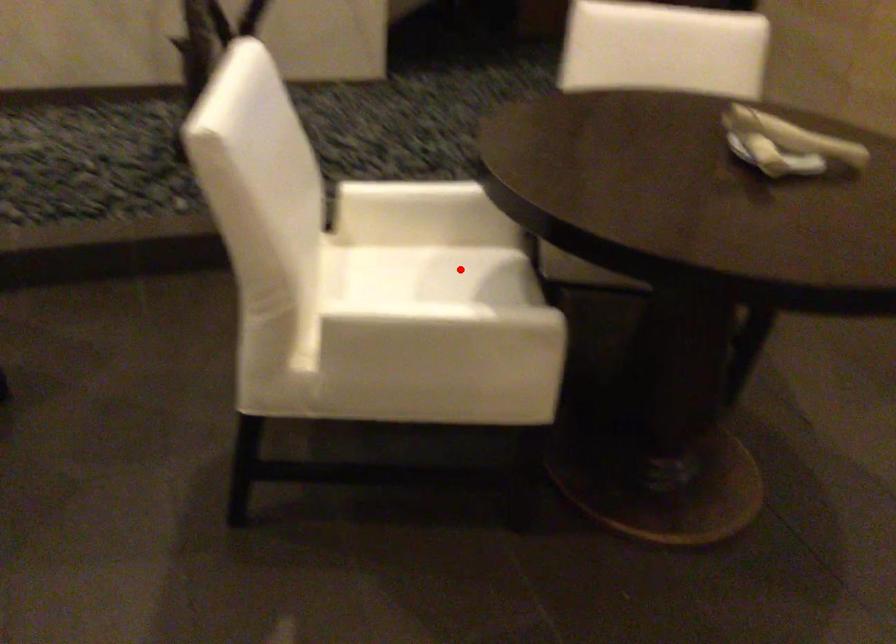
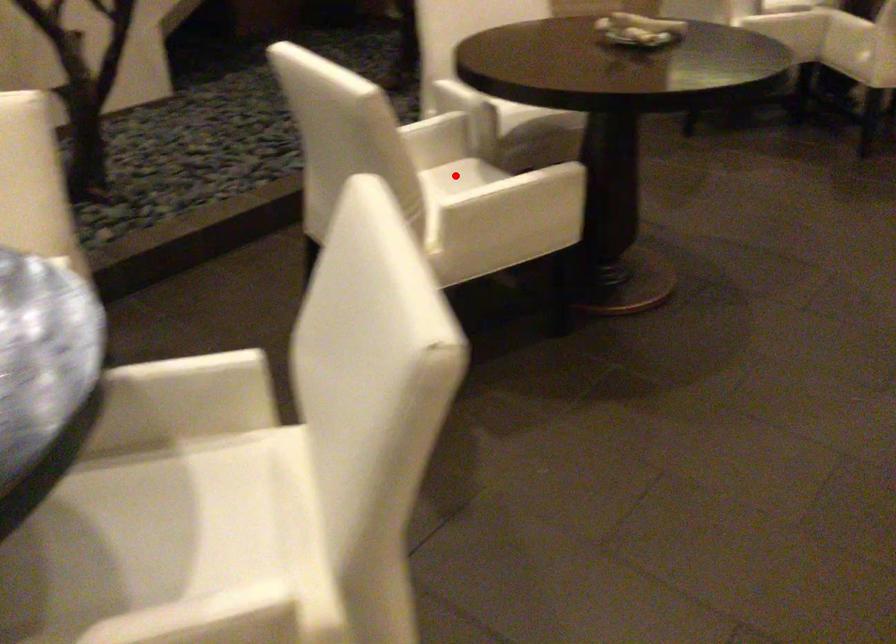
I am providing you with two images of the same scene from different viewpoints. A red point is marked on the first image and another point is marked on the second image. Is the marked point in image1 the same physical position as the marked point in image2?

Yes